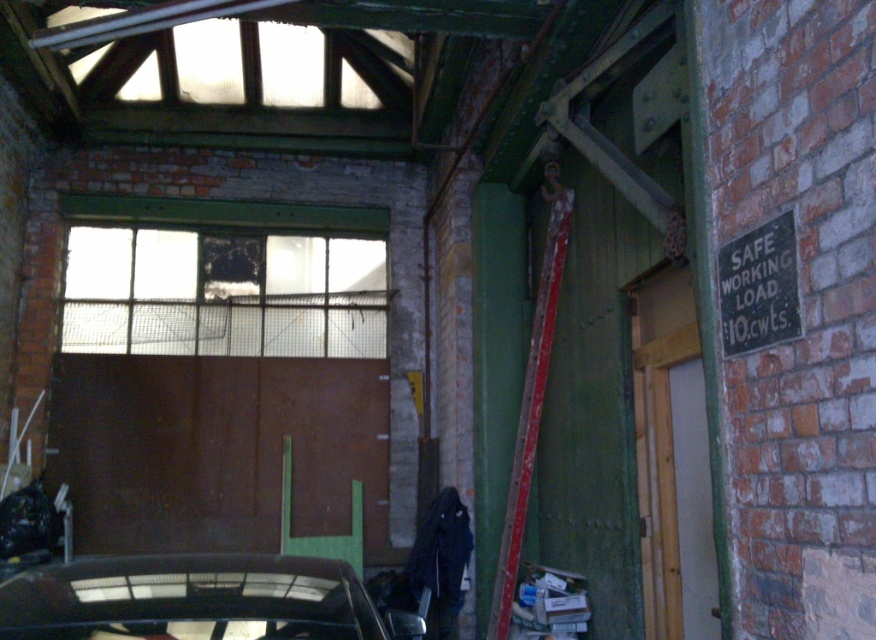
You are a maintenance worker needing to reach the window above the rusty metal garage door at center. You see a rusty metal ladder at center. Can you use the ladder to reach the window?

The rusty metal garage door at center is below the rusty metal ladder at center, so the ladder is positioned above the door. Since the window is above the door, the ladder is already placed in a position that allows access to the window.